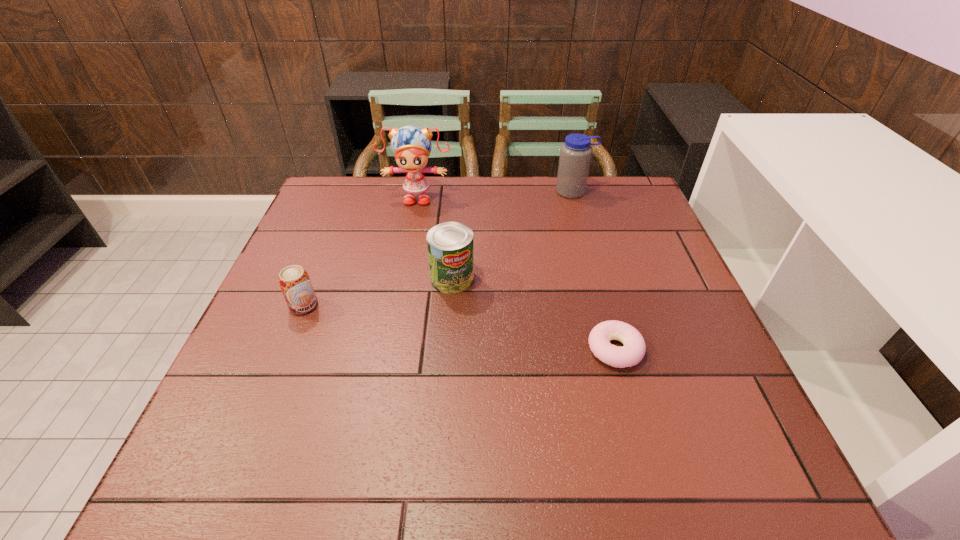
You are a GUI agent. You are given a task and a screenshot of the screen. Output one action in this format:
    pyautogui.click(x=<x>, y=<y>)
    Task: Click on the vacant area at the near edge of the desktop
    Image resolution: width=960 pixels, height=540 pixels.
    Given the screenshot: What is the action you would take?
    pyautogui.click(x=444, y=458)

I want to click on vacant region at the left edge, so point(257,402).

The width and height of the screenshot is (960, 540). What are the coordinates of `free location at the right edge` in the screenshot? It's located at (636, 302).

Locate an element on the screen. free space at the far left corner is located at coordinates (363, 217).

In the image, there is a desktop. At what (x,y) coordinates should I click in order to perform the action: click on vacant space at the near left corner. Please return your answer as a coordinate pair (x, y). Image resolution: width=960 pixels, height=540 pixels. Looking at the image, I should click on (190, 488).

You are a GUI agent. You are given a task and a screenshot of the screen. Output one action in this format:
    pyautogui.click(x=<x>, y=<y>)
    Task: Click on the vacant position at the far right corner of the desktop
    This screenshot has width=960, height=540.
    Given the screenshot: What is the action you would take?
    pyautogui.click(x=597, y=194)

Locate an element on the screen. This screenshot has height=540, width=960. vacant area between the beer can and the can is located at coordinates (378, 292).

Locate an element on the screen. The width and height of the screenshot is (960, 540). vacant point located between the water bottle and the third farthest object is located at coordinates (513, 235).

Find the location of `empty space between the tallest object and the water bottle`. empty space between the tallest object and the water bottle is located at coordinates (495, 194).

Find the location of a particular element. The width and height of the screenshot is (960, 540). vacant area between the third shortest object and the second nearest object is located at coordinates (378, 292).